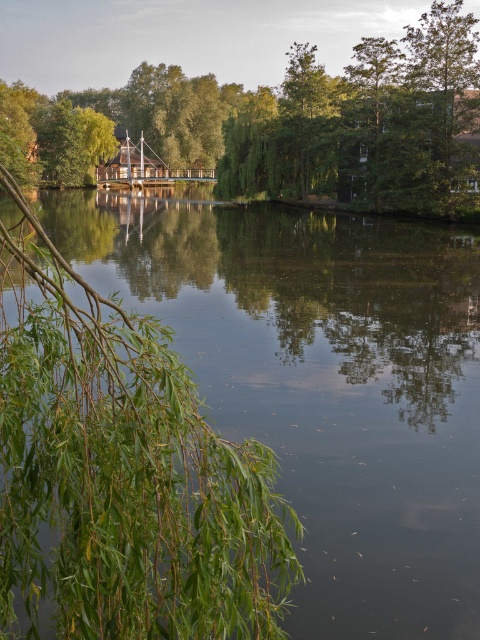
Consider the image. You are standing on the wooden bridge and want to reach the green leafy tree at center. Which direction should you walk to avoid the green leafy branches at lower left?

Since the green leafy branches at lower left are to the left of the green leafy tree at center, you should walk to the right to avoid them and reach the green leafy tree at center.

You are an artist wanting to paint the lakeside scene. You have two brushes, one thin and one thick. Which brush should you use for the green leafy branches at lower left and which for the green leafy tree at center?

Use the thin brush for the green leafy branches at lower left since it is thinner, and the thick brush for the green leafy tree at center because it is wider.

You are standing at the lakeside and want to know which of the two points, point (173, 592) or point (385, 61), is closer to you. Can you determine this based on the scene?

Point (173, 592) is closer to the viewer than point (385, 61).